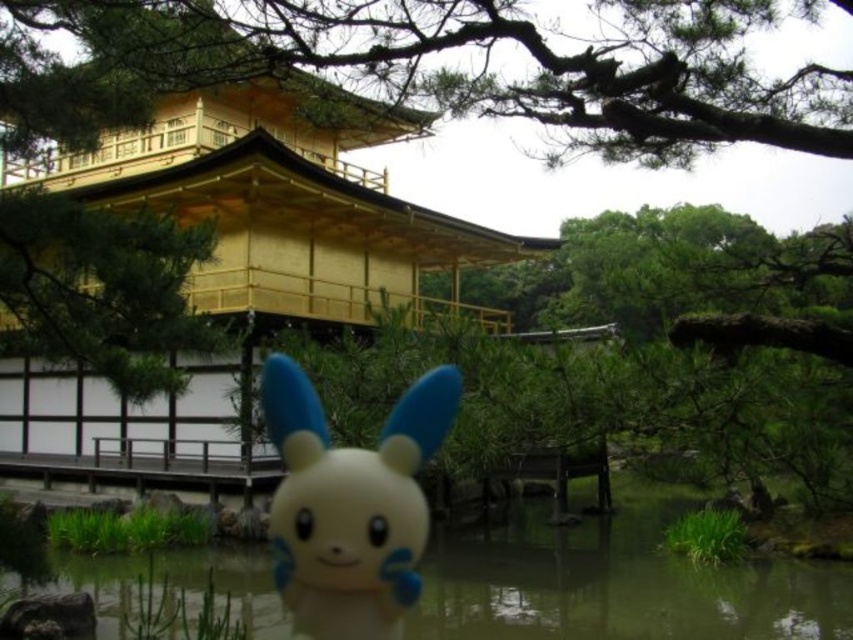
Question: Can you confirm if transparent plastic water at lower center is smaller than white matte plush at center?

Choices:
 (A) no
 (B) yes

Answer: (A)

Question: Which point is closer to the camera?

Choices:
 (A) transparent plastic water at lower center
 (B) white matte plush at center

Answer: (B)

Question: In this image, where is transparent plastic water at lower center located relative to white matte plush at center?

Choices:
 (A) left
 (B) right

Answer: (B)

Question: Which object appears closest to the camera in this image?

Choices:
 (A) transparent plastic water at lower center
 (B) white matte plush at center

Answer: (B)

Question: Can you confirm if transparent plastic water at lower center is positioned below white matte plush at center?

Choices:
 (A) no
 (B) yes

Answer: (B)